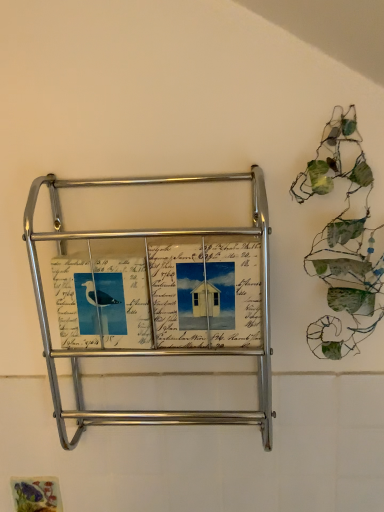
Question: Should I look upward or downward to see metallic magazine rack at center?

Choices:
 (A) down
 (B) up

Answer: (A)